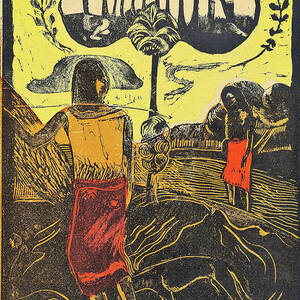
I want to click on leg, so click(232, 191).